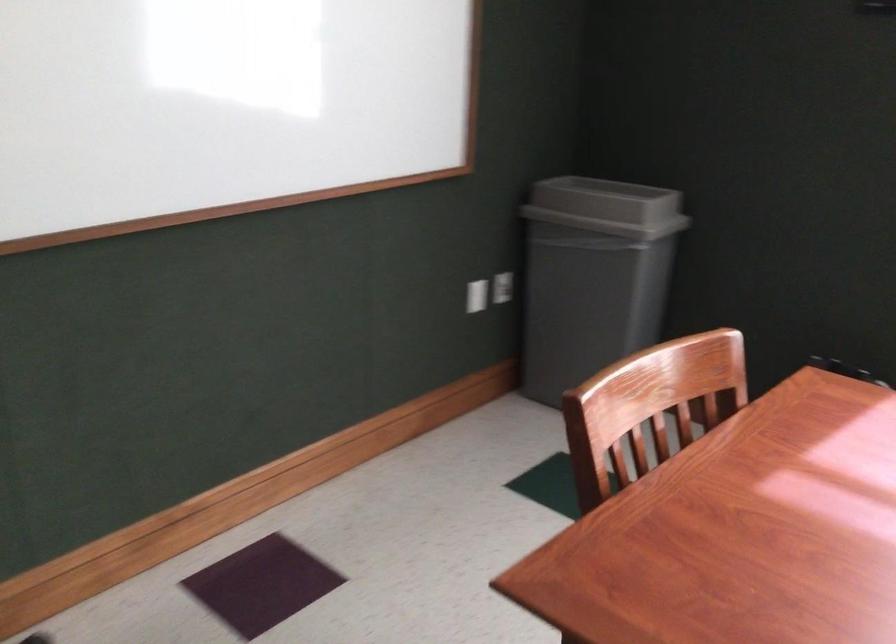
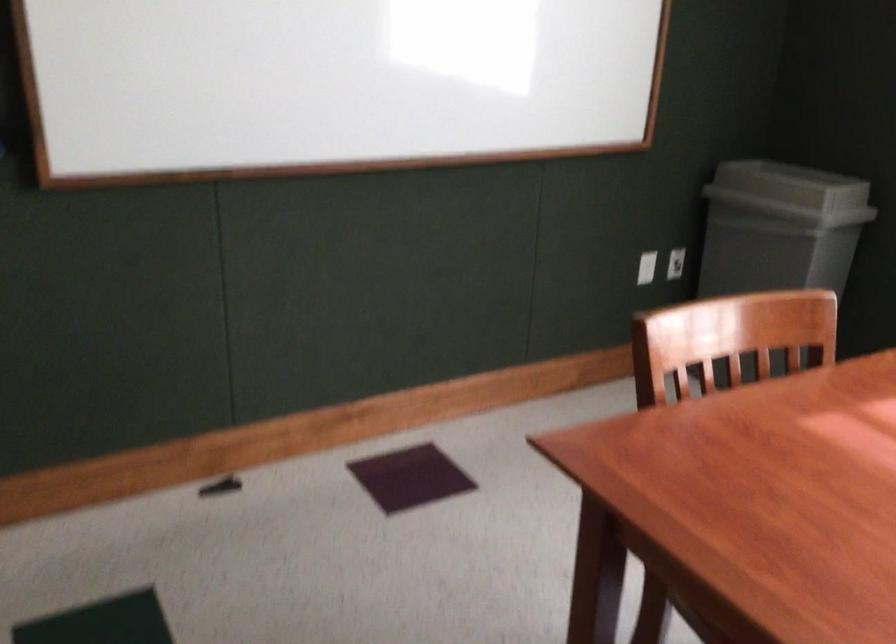
The point at (500, 292) is marked in the first image. Where is the corresponding point in the second image?

(675, 263)